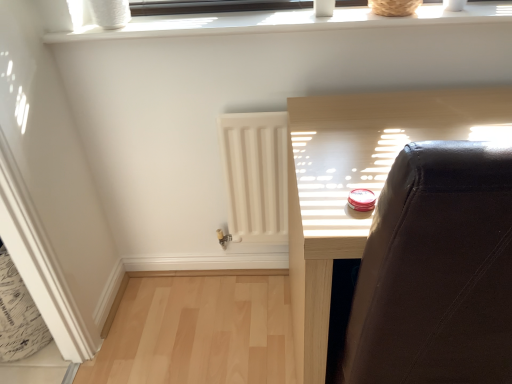
Question: In the image, is white matte radiator at center positioned in front of or behind white plastic window frame at upper center, which is the first window frame from bottom to top?

Choices:
 (A) front
 (B) behind

Answer: (B)

Question: Would you say white matte radiator at center is to the left or to the right of white plastic window frame at upper center, which is the first window frame from bottom to top, in the picture?

Choices:
 (A) left
 (B) right

Answer: (A)

Question: Which of these objects is positioned farthest from the matte black chair at upper right?

Choices:
 (A) white matte radiator at center
 (B) dark brown wood window frame at upper center, which appears as the 2th window frame when ordered from the bottom
 (C) white plastic window frame at upper center, which is the first window frame from bottom to top

Answer: (B)

Question: Based on their relative distances, which object is farther from the dark brown wood window frame at upper center, the 1th window frame when ordered from top to bottom?

Choices:
 (A) white matte radiator at center
 (B) matte black chair at upper right
 (C) white plastic window frame at upper center, the 2th window frame from the top

Answer: (A)